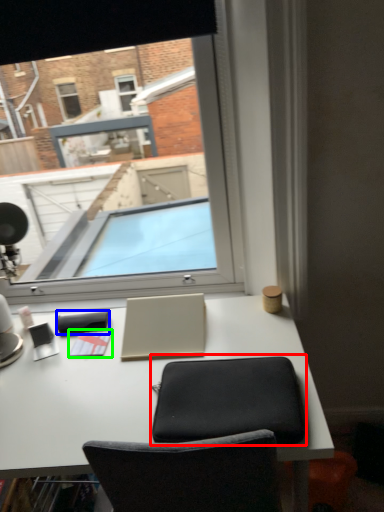
Question: Considering the real-world distances, which object is farthest from computer chair (highlighted by a red box)? notepad (highlighted by a blue box) or notepad (highlighted by a green box)?

Choices:
 (A) notepad
 (B) notepad

Answer: (A)